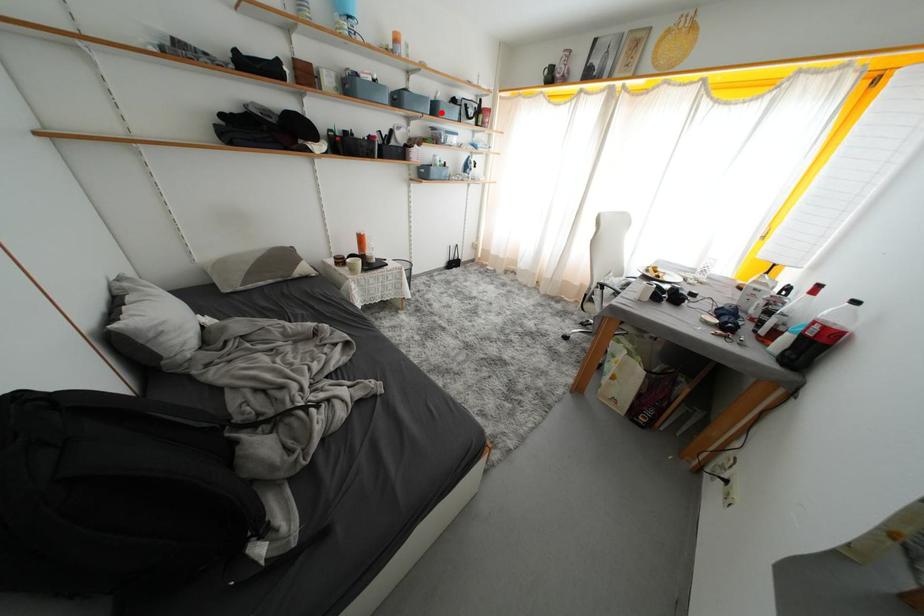
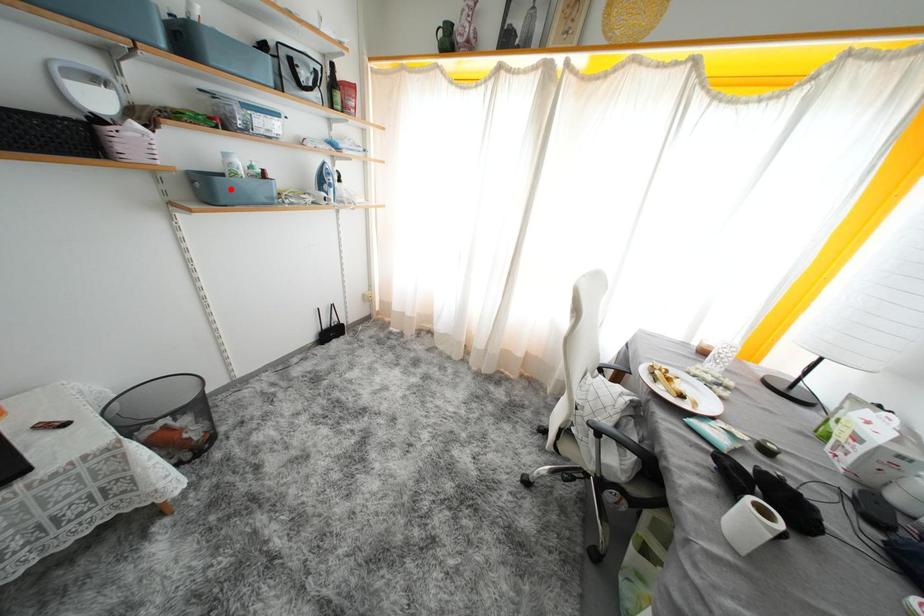
Consider the image. I am providing you with two images of the same scene from different viewpoints. A red point is marked on the first image and another point is marked on the second image. Are the points marked in image1 and image2 representing the same 3D position?

No